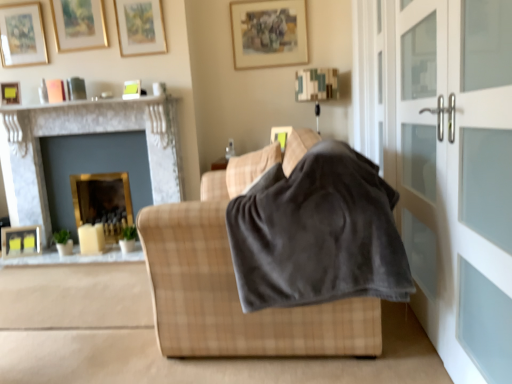
Question: Is gold-framed mirror at left, the second fireplace in the left-to-right sequence, in contact with plaid fabric couch at center?

Choices:
 (A) yes
 (B) no

Answer: (B)

Question: Is gold-framed mirror at left, marked as the 1th fireplace in a right-to-left arrangement, not inside plaid fabric couch at center?

Choices:
 (A) no
 (B) yes

Answer: (B)

Question: From the image's perspective, would you say gold-framed mirror at left, the second fireplace in the left-to-right sequence, is shown under plaid fabric couch at center?

Choices:
 (A) yes
 (B) no

Answer: (A)

Question: From the image's perspective, is gold-framed mirror at left, the second fireplace in the left-to-right sequence, located above plaid fabric couch at center?

Choices:
 (A) no
 (B) yes

Answer: (A)

Question: Is gold-framed mirror at left, marked as the 1th fireplace in a right-to-left arrangement, positioned before plaid fabric couch at center?

Choices:
 (A) yes
 (B) no

Answer: (B)

Question: From a real-world perspective, is gold-framed mirror at left, the second fireplace in the left-to-right sequence, located higher than plaid fabric couch at center?

Choices:
 (A) no
 (B) yes

Answer: (A)

Question: Can you confirm if gold-framed picture at upper left, which appears as the second picture frame when viewed from the top, is bigger than marble fireplace at left, which appears as the first fireplace when viewed from the left?

Choices:
 (A) yes
 (B) no

Answer: (B)

Question: From the image's perspective, is gold-framed picture at upper left, the fourth picture frame in the right-to-left sequence, under marble fireplace at left, which appears as the first fireplace when viewed from the left?

Choices:
 (A) no
 (B) yes

Answer: (A)

Question: Can you confirm if gold-framed picture at upper left, which appears as the second picture frame when viewed from the top, is positioned to the left of marble fireplace at left, which appears as the first fireplace when viewed from the left?

Choices:
 (A) yes
 (B) no

Answer: (A)

Question: From a real-world perspective, does gold-framed picture at upper left, which ranks as the 6th picture frame in bottom-to-top order, stand above marble fireplace at left, which appears as the first fireplace when viewed from the left?

Choices:
 (A) yes
 (B) no

Answer: (A)

Question: Does gold-framed picture at upper left, the fourth picture frame in the right-to-left sequence, have a lesser width compared to marble fireplace at left, which appears as the first fireplace when viewed from the left?

Choices:
 (A) no
 (B) yes

Answer: (B)

Question: Is gold-framed picture at upper left, which appears as the second picture frame when viewed from the top, positioned far away from marble fireplace at left, which appears as the first fireplace when viewed from the left?

Choices:
 (A) yes
 (B) no

Answer: (B)

Question: Is gold-framed picture at upper left, the 2th picture frame positioned from the left, at the left side of satin white screen door at right, which appears as the second screen door when viewed from the back?

Choices:
 (A) yes
 (B) no

Answer: (A)